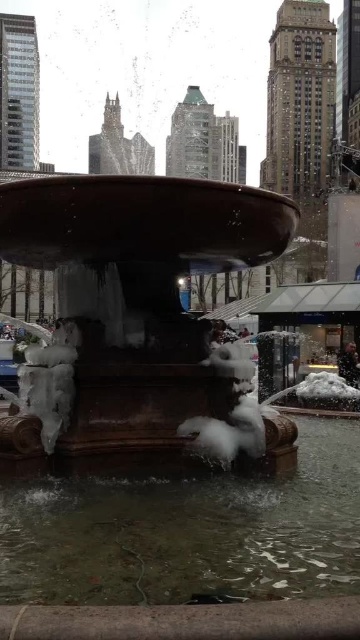
You are a photographer planning to capture the bronze fountain at center and the clear water at fountain center in a single shot. Based on their positions, which object should you focus on first to ensure both are in frame?

The bronze fountain at center is positioned on the left side of clear water at fountain center, so focusing on the bronze fountain at center first would allow you to frame both objects effectively.